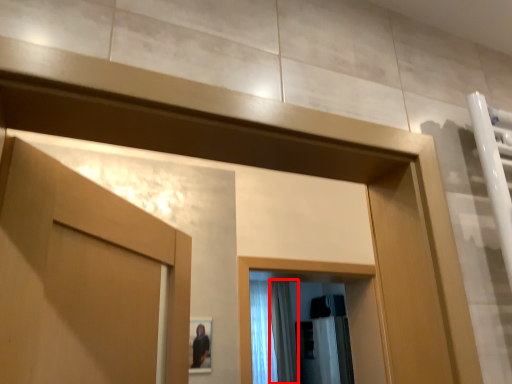
Question: From the image's perspective, where is shower curtain (annotated by the red box) located relative to shower curtain?

Choices:
 (A) above
 (B) below

Answer: (B)